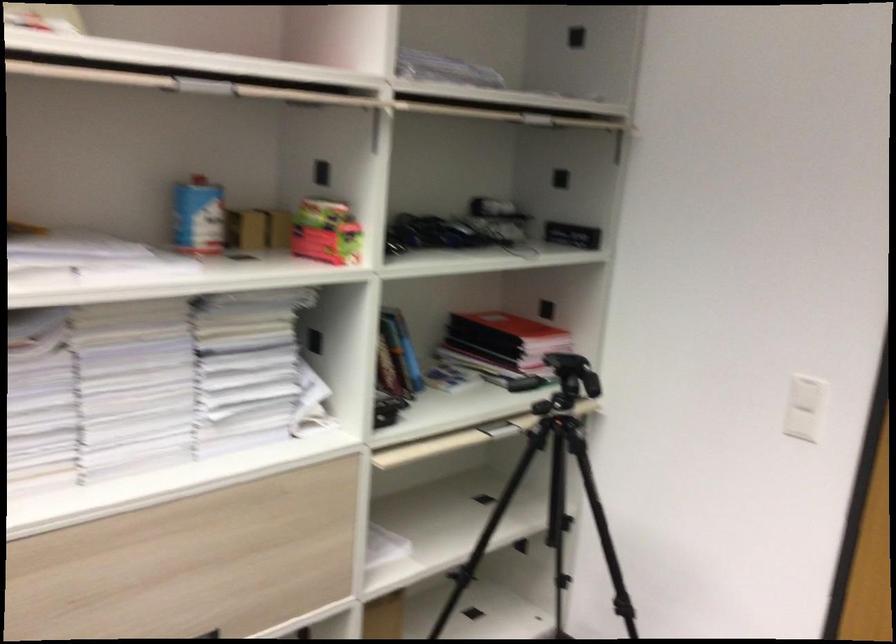
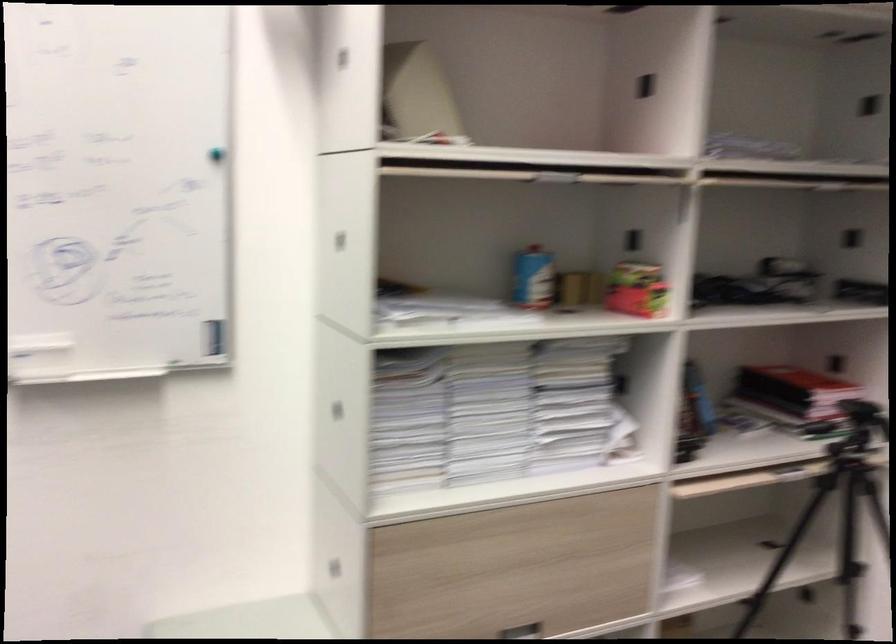
Find the pixel in the second image that matches [384,553] in the first image.

(678, 581)